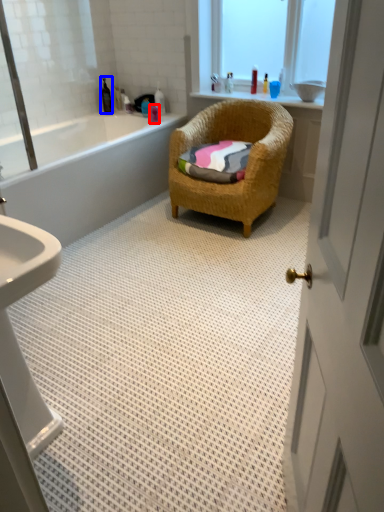
Question: Which object appears farthest to the camera in this image, toiletry (highlighted by a red box) or toiletry (highlighted by a blue box)?

Choices:
 (A) toiletry
 (B) toiletry

Answer: (B)